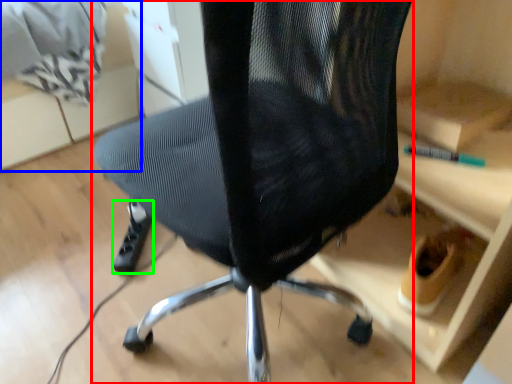
Question: Estimate the real-world distances between objects in this image. Which object is farther from chair (highlighted by a red box), shelf (highlighted by a blue box) or foot (highlighted by a green box)?

Choices:
 (A) shelf
 (B) foot

Answer: (A)